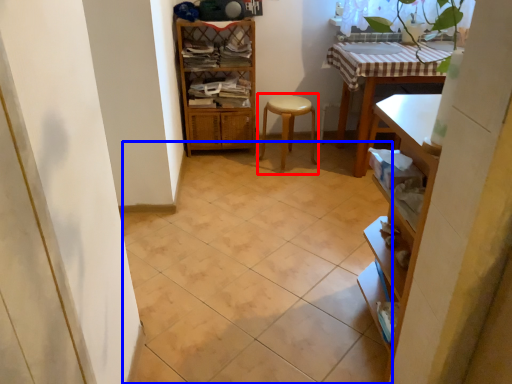
Question: Which point is further to the camera, step stool (highlighted by a red box) or ceramic tile (highlighted by a blue box)?

Choices:
 (A) step stool
 (B) ceramic tile

Answer: (A)